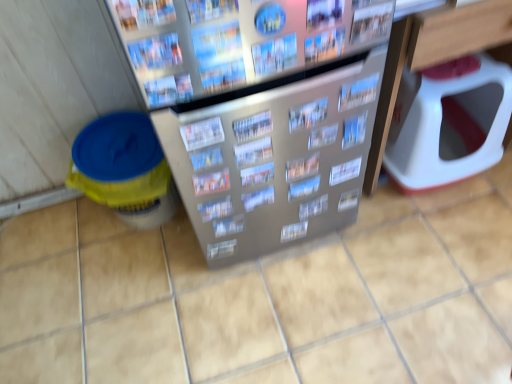
Question: Which direction should I rotate to look at metallic silver magazine at center, the 3th magazine positioned from the back?

Choices:
 (A) right
 (B) left

Answer: (A)

Question: From a real-world perspective, is printed paper magazine at center, which is counted as the 6th magazine, starting from the back, under metallic silver magazine at center, the 4th magazine from the front?

Choices:
 (A) yes
 (B) no

Answer: (A)

Question: Can we say printed paper magazine at center, which is counted as the 6th magazine, starting from the back, lies outside metallic silver magazine at center, the 4th magazine from the front?

Choices:
 (A) yes
 (B) no

Answer: (A)

Question: Is printed paper magazine at center, which is counted as the 6th magazine, starting from the back, next to metallic silver magazine at center, the 4th magazine from the front?

Choices:
 (A) no
 (B) yes

Answer: (A)

Question: Does printed paper magazine at center, marked as the 8th magazine in a front-to-back arrangement, have a smaller size compared to metallic silver magazine at center, the tenth magazine positioned from the back?

Choices:
 (A) yes
 (B) no

Answer: (B)

Question: Are printed paper magazine at center, marked as the 8th magazine in a front-to-back arrangement, and metallic silver magazine at center, the tenth magazine positioned from the back, located far from each other?

Choices:
 (A) no
 (B) yes

Answer: (A)

Question: From a real-world perspective, is printed paper magazine at center, marked as the 8th magazine in a front-to-back arrangement, on top of metallic silver magazine at center, the tenth magazine positioned from the back?

Choices:
 (A) no
 (B) yes

Answer: (A)

Question: Does metallic silver magazine at center, the 9th magazine in the back-to-front sequence, have a smaller size compared to metallic silver magazine at center, the 3th magazine positioned from the back?

Choices:
 (A) yes
 (B) no

Answer: (A)

Question: Is metallic silver magazine at center, which is the fifth magazine from front to back, shorter than metallic silver magazine at center, placed as the 11th magazine when sorted from front to back?

Choices:
 (A) no
 (B) yes

Answer: (B)

Question: Can you confirm if metallic silver magazine at center, which is the fifth magazine from front to back, is bigger than metallic silver magazine at center, placed as the 11th magazine when sorted from front to back?

Choices:
 (A) no
 (B) yes

Answer: (A)

Question: From a real-world perspective, is metallic silver magazine at center, which is the fifth magazine from front to back, on top of metallic silver magazine at center, the 3th magazine positioned from the back?

Choices:
 (A) no
 (B) yes

Answer: (B)

Question: Is metallic silver magazine at center, which is the fifth magazine from front to back, to the right of metallic silver magazine at center, placed as the 11th magazine when sorted from front to back, from the viewer's perspective?

Choices:
 (A) yes
 (B) no

Answer: (B)

Question: Is metallic silver magazine at center, which is the fifth magazine from front to back, at the left side of metallic silver magazine at center, the 3th magazine positioned from the back?

Choices:
 (A) no
 (B) yes

Answer: (B)

Question: Does metallic silver magazine at upper center, positioned as the 7th magazine in back-to-front order, contain printed paper magazine at center, arranged as the 12th magazine when viewed from the front?

Choices:
 (A) yes
 (B) no

Answer: (B)